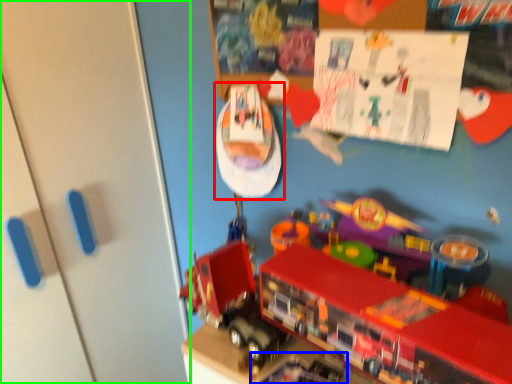
Question: Which object is the farthest from toy (highlighted by a red box)? Choose among these: toy (highlighted by a blue box) or door (highlighted by a green box).

Choices:
 (A) toy
 (B) door

Answer: (A)